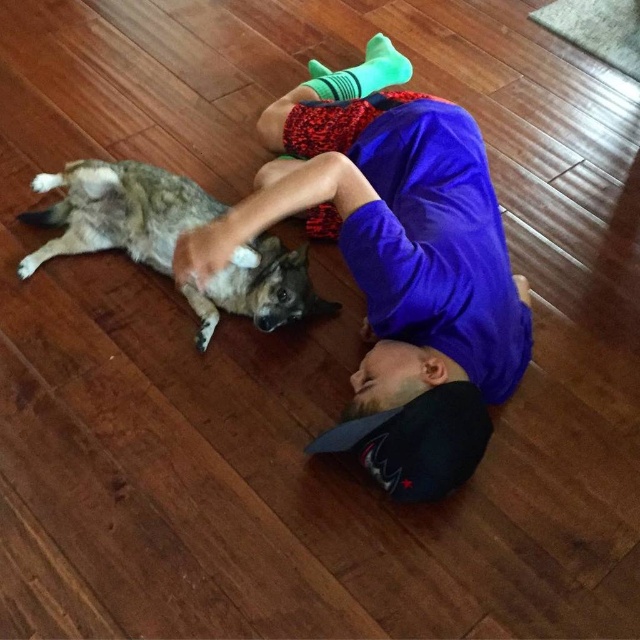
You are a photographer setting up a shoot in this scene. You need to position a small tripod so that it doesn not block either the purple cotton shirt at center or the brown fur dog at upper left. Given that the tripod requires 30 cm of space in front of it, where should you place the tripod to ensure both objects remain visible and unobstructed?

The purple cotton shirt at center is taller than the brown fur dog at upper left. To avoid blocking either, place the tripod 30 cm in front of the purple cotton shirt at center, ensuring it doesn not obscure the view of either object.

You are a photographer setting up a shoot in the scene. You need to position a light source to the left of the purple cotton shirt at center and to the right of the brown fur dog at upper left. Is this possible given their positions?

The purple cotton shirt at center is to the right of the brown fur dog at upper left, so placing the light source between them would be possible as the shirt is already positioned to the right of the dog.